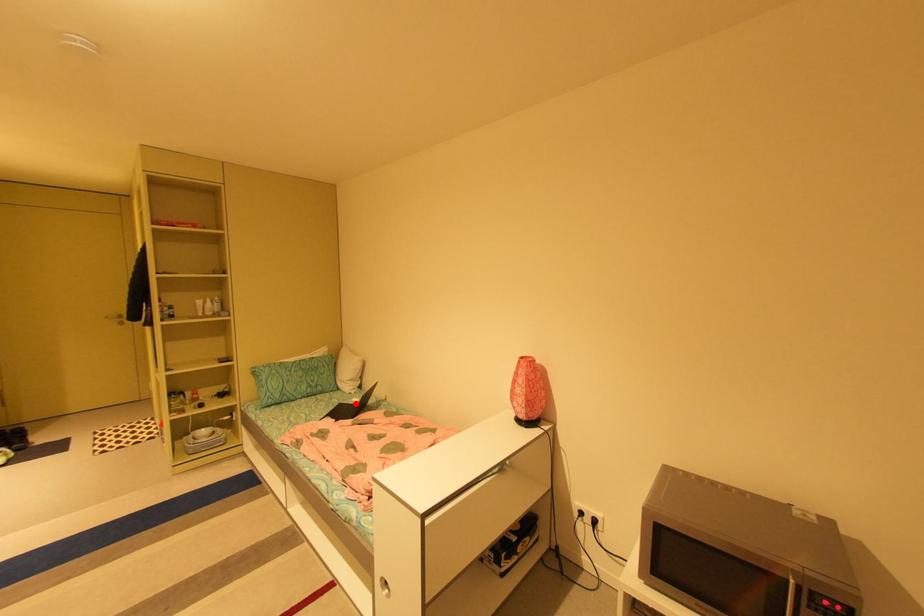
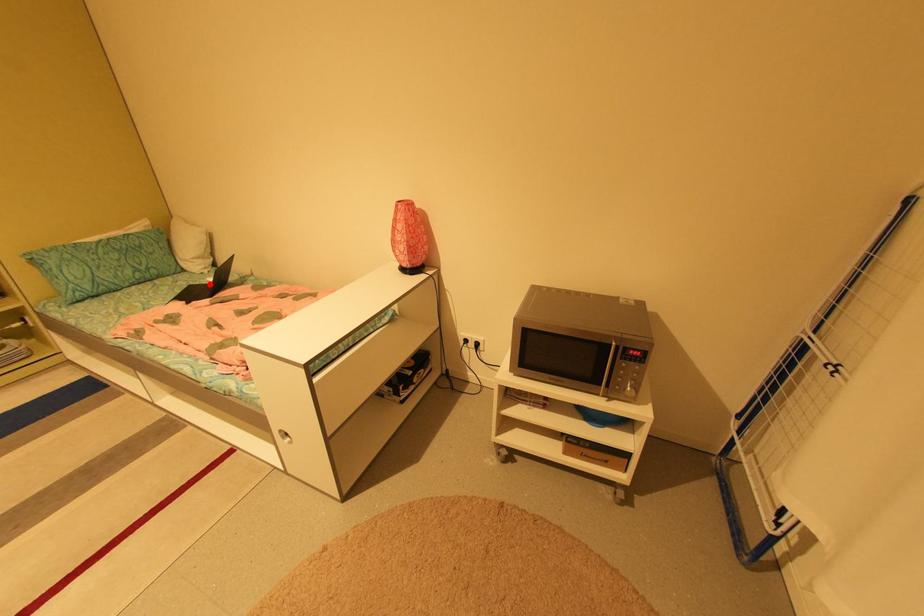
I am providing you with two images of the same scene from different viewpoints. A red point is marked on the first image and another point is marked on the second image. Is the red point in image1 aligned with the point shown in image2?

Yes